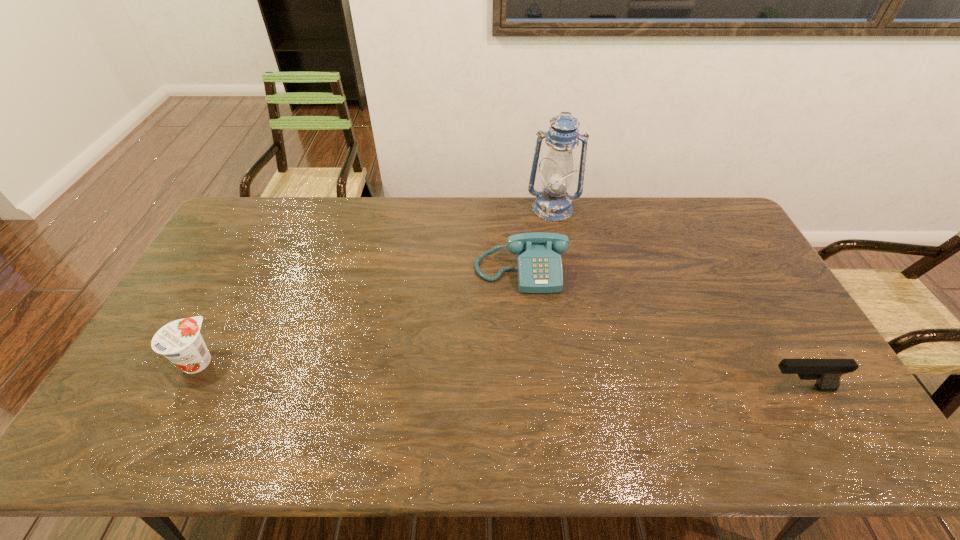
Find the location of a particular element. This screenshot has height=540, width=960. free space on the desktop that is between the leftmost object and the nearest object and is positioned on the dial of the telephone is located at coordinates (533, 376).

Where is `vacant space on the desktop that is between the second nearest object and the pistol and is positioned on the front-facing side of the farthest object`? vacant space on the desktop that is between the second nearest object and the pistol and is positioned on the front-facing side of the farthest object is located at coordinates point(547,376).